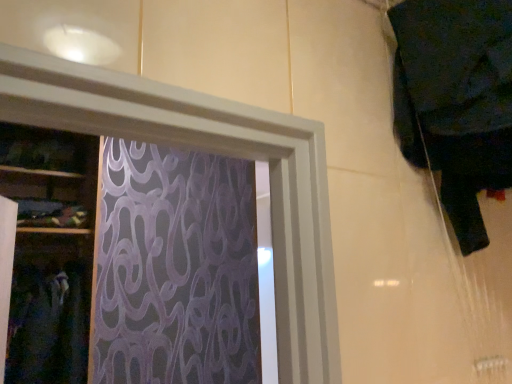
The image size is (512, 384). What do you see at coordinates (456, 101) in the screenshot?
I see `dark fabric at upper right, the 1th clothing when ordered from right to left` at bounding box center [456, 101].

This screenshot has height=384, width=512. What are the coordinates of `dark fabric at upper right, the 2th clothing in the bottom-to-top sequence` in the screenshot? It's located at (456, 101).

How much space does dark fabric at left, marked as the 2th clothing in a right-to-left arrangement, occupy vertically?

The height of dark fabric at left, marked as the 2th clothing in a right-to-left arrangement, is 59.03 centimeters.

Identify the location of dark fabric at left, the first clothing from the back. Image resolution: width=512 pixels, height=384 pixels. (48, 326).

The height and width of the screenshot is (384, 512). Describe the element at coordinates (48, 326) in the screenshot. I see `dark fabric at left, the first clothing when ordered from bottom to top` at that location.

Find the location of `dark fabric at upper right, the 1th clothing when ordered from right to left`. dark fabric at upper right, the 1th clothing when ordered from right to left is located at coordinates (456, 101).

Is dark fabric at left, which appears as the first clothing when viewed from the left, to the left of dark fabric at upper right, the 2th clothing in the left-to-right sequence, from the viewer's perspective?

Yes, dark fabric at left, which appears as the first clothing when viewed from the left, is to the left of dark fabric at upper right, the 2th clothing in the left-to-right sequence.

Is dark fabric at left, the first clothing from the back, behind dark fabric at upper right, the second clothing from the back?

Yes.

Does point (73, 303) come in front of point (414, 109)?

No, (73, 303) is behind (414, 109).

From the image's perspective, between dark fabric at left, which appears as the first clothing when viewed from the left, and dark fabric at upper right, the 1th clothing when ordered from right to left, who is located below?

dark fabric at left, which appears as the first clothing when viewed from the left, from the image's perspective.

From a real-world perspective, is dark fabric at left, the first clothing when ordered from bottom to top, positioned above or below dark fabric at upper right, the 1th clothing when ordered from right to left?

From a real-world perspective, dark fabric at left, the first clothing when ordered from bottom to top, is physically below dark fabric at upper right, the 1th clothing when ordered from right to left.

Which object is thinner, dark fabric at left, the first clothing from the back, or dark fabric at upper right, positioned as the 1th clothing in top-to-bottom order?

dark fabric at upper right, positioned as the 1th clothing in top-to-bottom order, is thinner.

Is dark fabric at left, which appears as the first clothing when viewed from the left, taller than dark fabric at upper right, positioned as the first clothing in front-to-back order?

Yes.

Can you confirm if dark fabric at left, marked as the 2th clothing in a right-to-left arrangement, is bigger than dark fabric at upper right, the 2th clothing in the left-to-right sequence?

Indeed, dark fabric at left, marked as the 2th clothing in a right-to-left arrangement, has a larger size compared to dark fabric at upper right, the 2th clothing in the left-to-right sequence.

Is dark fabric at left, which appears as the first clothing when viewed from the left, located outside dark fabric at upper right, positioned as the first clothing in front-to-back order?

Yes, dark fabric at left, which appears as the first clothing when viewed from the left, is not within dark fabric at upper right, positioned as the first clothing in front-to-back order.

Is dark fabric at left, the second clothing viewed from the top, next to dark fabric at upper right, the 2th clothing in the left-to-right sequence, and touching it?

No.

Is dark fabric at left, the second clothing viewed from the top, looking in the opposite direction of dark fabric at upper right, positioned as the 1th clothing in top-to-bottom order?

No, dark fabric at left, the second clothing viewed from the top, is not facing away from dark fabric at upper right, positioned as the 1th clothing in top-to-bottom order.

Can you tell me how much dark fabric at left, the first clothing when ordered from bottom to top, and dark fabric at upper right, positioned as the 1th clothing in top-to-bottom order, differ in facing direction?

90 degrees separate the facing orientations of dark fabric at left, the first clothing when ordered from bottom to top, and dark fabric at upper right, positioned as the 1th clothing in top-to-bottom order.

Measure the distance from dark fabric at left, the second clothing viewed from the top, to dark fabric at upper right, positioned as the 1th clothing in top-to-bottom order.

They are 1.60 meters apart.

You are a GUI agent. You are given a task and a screenshot of the screen. Output one action in this format:
    pyautogui.click(x=<x>, y=<y>)
    Task: Click on the clothing directly beneath the dark fabric at upper right, the 1th clothing when ordered from right to left (from a real-world perspective)
    This screenshot has height=384, width=512.
    Given the screenshot: What is the action you would take?
    pyautogui.click(x=48, y=326)

Is dark fabric at upper right, the 2th clothing in the left-to-right sequence, to the left of dark fabric at left, the 2th clothing when ordered from front to back, from the viewer's perspective?

No.

Which object is further away from the camera, dark fabric at upper right, the 1th clothing when ordered from right to left, or dark fabric at left, the first clothing when ordered from bottom to top?

dark fabric at left, the first clothing when ordered from bottom to top, is behind.

Is point (510, 156) less distant than point (64, 316)?

Yes, point (510, 156) is closer to viewer.

From the image's perspective, is dark fabric at upper right, the 2th clothing in the bottom-to-top sequence, positioned above or below dark fabric at left, which appears as the first clothing when viewed from the left?

Clearly, from the image's perspective, dark fabric at upper right, the 2th clothing in the bottom-to-top sequence, is above dark fabric at left, which appears as the first clothing when viewed from the left.

In the scene shown: From a real-world perspective, between dark fabric at upper right, the 2th clothing in the left-to-right sequence, and dark fabric at left, which appears as the first clothing when viewed from the left, who is vertically lower?

dark fabric at left, which appears as the first clothing when viewed from the left, is physically lower.

Which object is wider, dark fabric at upper right, positioned as the 1th clothing in top-to-bottom order, or dark fabric at left, the second clothing viewed from the top?

dark fabric at left, the second clothing viewed from the top, is wider.

Considering the sizes of objects dark fabric at upper right, positioned as the first clothing in front-to-back order, and dark fabric at left, which appears as the first clothing when viewed from the left, in the image provided, who is shorter, dark fabric at upper right, positioned as the first clothing in front-to-back order, or dark fabric at left, which appears as the first clothing when viewed from the left,?

With less height is dark fabric at upper right, positioned as the first clothing in front-to-back order.

Considering the relative sizes of dark fabric at upper right, the 2th clothing in the bottom-to-top sequence, and dark fabric at left, marked as the 2th clothing in a right-to-left arrangement, in the image provided, is dark fabric at upper right, the 2th clothing in the bottom-to-top sequence, bigger than dark fabric at left, marked as the 2th clothing in a right-to-left arrangement,?

Actually, dark fabric at upper right, the 2th clothing in the bottom-to-top sequence, might be smaller than dark fabric at left, marked as the 2th clothing in a right-to-left arrangement.

Which is correct: dark fabric at upper right, the second clothing from the back, is inside dark fabric at left, the 2th clothing when ordered from front to back, or outside of it?

dark fabric at upper right, the second clothing from the back, is outside dark fabric at left, the 2th clothing when ordered from front to back.

Would you consider dark fabric at upper right, the second clothing from the back, to be distant from dark fabric at left, the first clothing when ordered from bottom to top?

Yes.

From the picture: Does dark fabric at upper right, the 2th clothing in the bottom-to-top sequence, turn towards dark fabric at left, marked as the 2th clothing in a right-to-left arrangement?

No, dark fabric at upper right, the 2th clothing in the bottom-to-top sequence, is not oriented towards dark fabric at left, marked as the 2th clothing in a right-to-left arrangement.

Measure the distance from dark fabric at upper right, the 1th clothing when ordered from right to left, to dark fabric at left, which appears as the first clothing when viewed from the left.

The distance of dark fabric at upper right, the 1th clothing when ordered from right to left, from dark fabric at left, which appears as the first clothing when viewed from the left, is 1.60 meters.

I want to click on clothing to the right of dark fabric at left, the second clothing viewed from the top, so click(456, 101).

Find the location of a particular element. clothing located underneath the dark fabric at upper right, positioned as the first clothing in front-to-back order (from a real-world perspective) is located at coordinates (48, 326).

What are the coordinates of `clothing to the right of dark fabric at left, the first clothing from the back` in the screenshot? It's located at (456, 101).